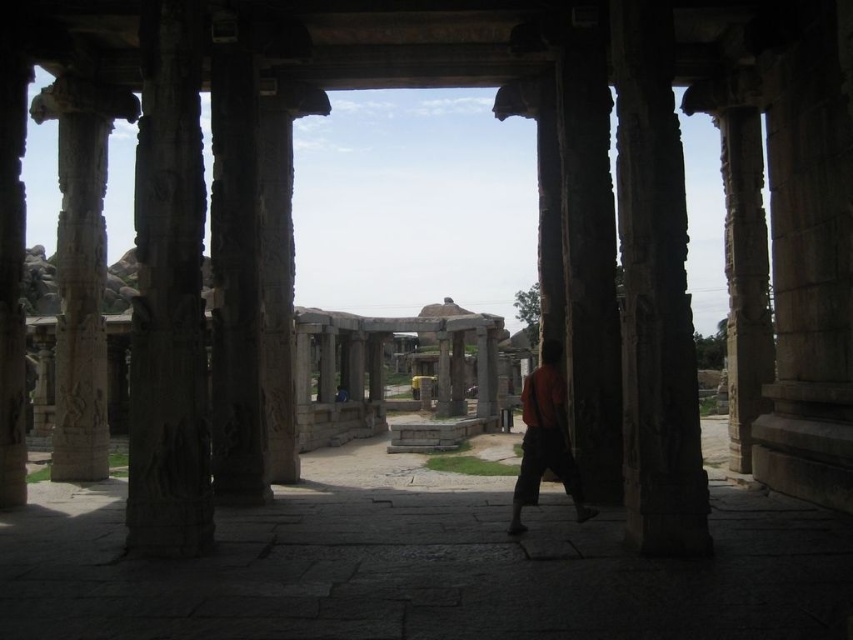
Consider the image. Is carved stone column at left shorter than orange fabric at center?

No, carved stone column at left is not shorter than orange fabric at center.

Can you confirm if carved stone column at left is bigger than orange fabric at center?

Indeed, carved stone column at left has a larger size compared to orange fabric at center.

What do you see at coordinates (167, 298) in the screenshot? I see `carved stone column at left` at bounding box center [167, 298].

In order to click on carved stone column at left in this screenshot , I will do (x=167, y=298).